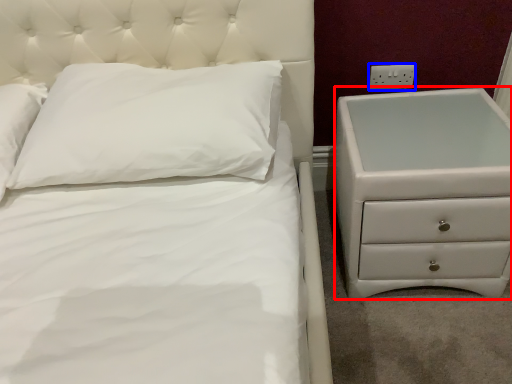
Question: Among these objects, which one is nearest to the camera, chest of drawers (highlighted by a red box) or electric outlet (highlighted by a blue box)?

Choices:
 (A) chest of drawers
 (B) electric outlet

Answer: (A)